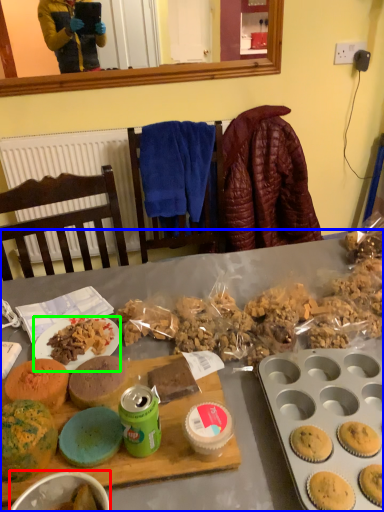
Question: Which is nearer to the bowl (highlighted by a red box)? desk (highlighted by a blue box) or plate (highlighted by a green box).

Choices:
 (A) desk
 (B) plate

Answer: (B)